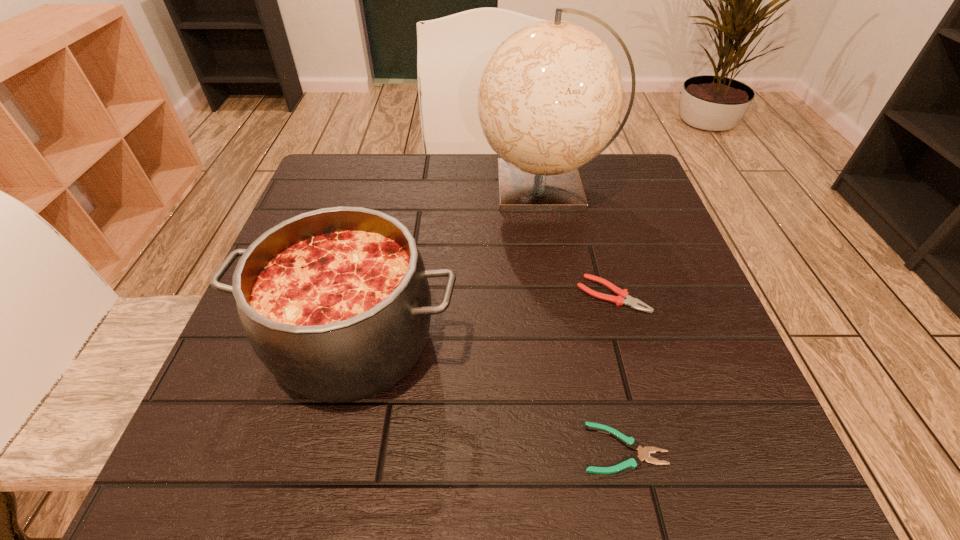
This screenshot has height=540, width=960. Find the location of `vacant space located 0.200m on the surface of the globe showing Europe and Africa`. vacant space located 0.200m on the surface of the globe showing Europe and Africa is located at coordinates (394, 187).

In order to click on free space located 0.270m on the back of the casserole in this screenshot , I will do `click(389, 197)`.

This screenshot has height=540, width=960. Identify the location of free spot located on the left of the taller pliers. (448, 295).

At what (x,y) coordinates should I click in order to perform the action: click on free spot located 0.050m on the back of the nearest object. Please return your answer as a coordinate pair (x, y). Looking at the image, I should click on (611, 393).

At what (x,y) coordinates should I click in order to perform the action: click on object at the far edge. Please return your answer as a coordinate pair (x, y). The image size is (960, 540). Looking at the image, I should click on (550, 97).

Locate an element on the screen. The image size is (960, 540). object that is at the near edge is located at coordinates (633, 461).

Where is `object situated at the left edge`? This screenshot has width=960, height=540. object situated at the left edge is located at coordinates (335, 302).

You are a GUI agent. You are given a task and a screenshot of the screen. Output one action in this format:
    pyautogui.click(x=<x>, y=<y>)
    Task: Click on the globe that is at the right edge
    
    Given the screenshot: What is the action you would take?
    pyautogui.click(x=550, y=97)

Locate an element on the screen. object positioned at the far right corner is located at coordinates pos(550,97).

You are a GUI agent. You are given a task and a screenshot of the screen. Output one action in this format:
    pyautogui.click(x=<x>, y=<y>)
    Task: Click on the object that is at the near right corner
    
    Given the screenshot: What is the action you would take?
    tap(633, 461)